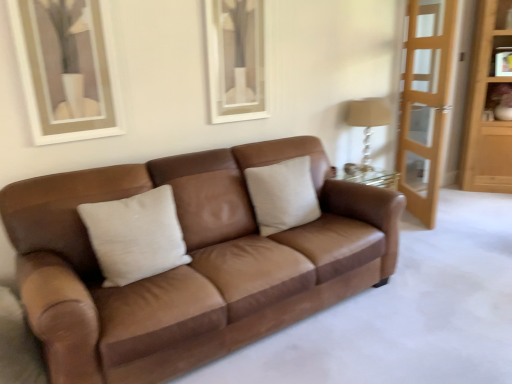
Question: Should I look upward or downward to see matte brown vase at upper right?

Choices:
 (A) down
 (B) up

Answer: (B)

Question: Does light brown wooden dresser at right have a smaller size compared to brown leather couch at center?

Choices:
 (A) no
 (B) yes

Answer: (B)

Question: Is light brown wooden dresser at right not within brown leather couch at center?

Choices:
 (A) yes
 (B) no

Answer: (A)

Question: Is light brown wooden dresser at right next to brown leather couch at center?

Choices:
 (A) no
 (B) yes

Answer: (A)

Question: Does light brown wooden dresser at right lie in front of brown leather couch at center?

Choices:
 (A) no
 (B) yes

Answer: (A)

Question: From a real-world perspective, is light brown wooden dresser at right physically above brown leather couch at center?

Choices:
 (A) no
 (B) yes

Answer: (B)

Question: Is light brown wooden dresser at right taller than brown leather couch at center?

Choices:
 (A) no
 (B) yes

Answer: (B)

Question: Can you confirm if light wood screen door at right is bigger than beige fabric lampshade at right?

Choices:
 (A) no
 (B) yes

Answer: (B)

Question: Does light wood screen door at right contain beige fabric lampshade at right?

Choices:
 (A) no
 (B) yes

Answer: (A)

Question: From a real-world perspective, is light wood screen door at right below beige fabric lampshade at right?

Choices:
 (A) yes
 (B) no

Answer: (B)

Question: Considering the relative positions of light wood screen door at right and beige fabric lampshade at right in the image provided, is light wood screen door at right in front of beige fabric lampshade at right?

Choices:
 (A) no
 (B) yes

Answer: (B)

Question: Is light wood screen door at right at the left side of beige fabric lampshade at right?

Choices:
 (A) no
 (B) yes

Answer: (A)

Question: Can you confirm if light wood screen door at right is shorter than beige fabric lampshade at right?

Choices:
 (A) yes
 (B) no

Answer: (B)

Question: Is light brown wooden dresser at right surrounded by light wood screen door at right?

Choices:
 (A) no
 (B) yes

Answer: (A)